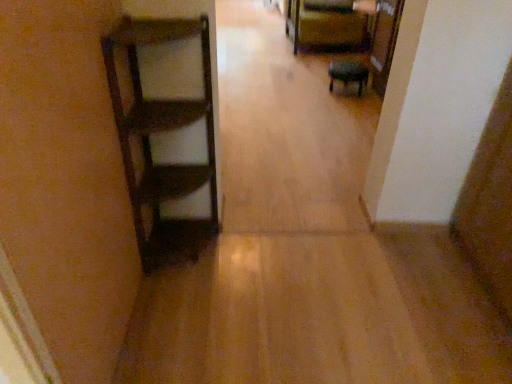
Question: In which direction should I rotate to look at matte black stool at center, marked as the 1th furniture in a front-to-back arrangement?

Choices:
 (A) right
 (B) left

Answer: (A)

Question: Which direction should I rotate to face matte brown chair at upper center, marked as the second furniture in a front-to-back arrangement, — up or down?

Choices:
 (A) up
 (B) down

Answer: (A)

Question: Would you say matte brown chair at upper center, which is the 1th furniture from top to bottom, contains matte black stool at center, the second furniture viewed from the back?

Choices:
 (A) yes
 (B) no

Answer: (B)

Question: Is matte brown chair at upper center, marked as the second furniture in a front-to-back arrangement, positioned with its back to matte black stool at center, marked as the 1th furniture in a front-to-back arrangement?

Choices:
 (A) no
 (B) yes

Answer: (A)

Question: Are matte brown chair at upper center, the second furniture positioned from the bottom, and matte black stool at center, which is the first furniture in bottom-to-top order, far apart?

Choices:
 (A) no
 (B) yes

Answer: (A)

Question: Is matte brown chair at upper center, marked as the second furniture in a front-to-back arrangement, wider than matte black stool at center, which is the first furniture in bottom-to-top order?

Choices:
 (A) yes
 (B) no

Answer: (A)

Question: Is matte brown chair at upper center, the second furniture positioned from the bottom, behind matte black stool at center, the second furniture viewed from the back?

Choices:
 (A) yes
 (B) no

Answer: (A)

Question: Is matte brown chair at upper center, which is the 1th furniture from top to bottom, at the right side of matte black stool at center, marked as the 1th furniture in a front-to-back arrangement?

Choices:
 (A) yes
 (B) no

Answer: (B)

Question: Is matte black stool at center, the second furniture viewed from the back, wider than matte brown chair at upper center, which is the 1th furniture from top to bottom?

Choices:
 (A) no
 (B) yes

Answer: (A)

Question: Can matte brown chair at upper center, positioned as the first furniture in back-to-front order, be found inside matte black stool at center, the second furniture viewed from the back?

Choices:
 (A) no
 (B) yes

Answer: (A)

Question: Is matte black stool at center, which is the first furniture in bottom-to-top order, positioned behind matte brown chair at upper center, which is the 1th furniture from top to bottom?

Choices:
 (A) yes
 (B) no

Answer: (B)

Question: From the image's perspective, is matte black stool at center, which is the first furniture in bottom-to-top order, below matte brown chair at upper center, marked as the second furniture in a front-to-back arrangement?

Choices:
 (A) yes
 (B) no

Answer: (A)

Question: Does matte black stool at center, the second furniture positioned from the top, have a larger size compared to matte brown chair at upper center, which is the 1th furniture from top to bottom?

Choices:
 (A) yes
 (B) no

Answer: (B)

Question: Is matte black stool at center, which is the first furniture in bottom-to-top order, oriented away from matte brown chair at upper center, which is the 1th furniture from top to bottom?

Choices:
 (A) no
 (B) yes

Answer: (A)

Question: Is matte black stool at center, the second furniture viewed from the back, bigger or smaller than matte brown chair at upper center, positioned as the first furniture in back-to-front order?

Choices:
 (A) big
 (B) small

Answer: (B)